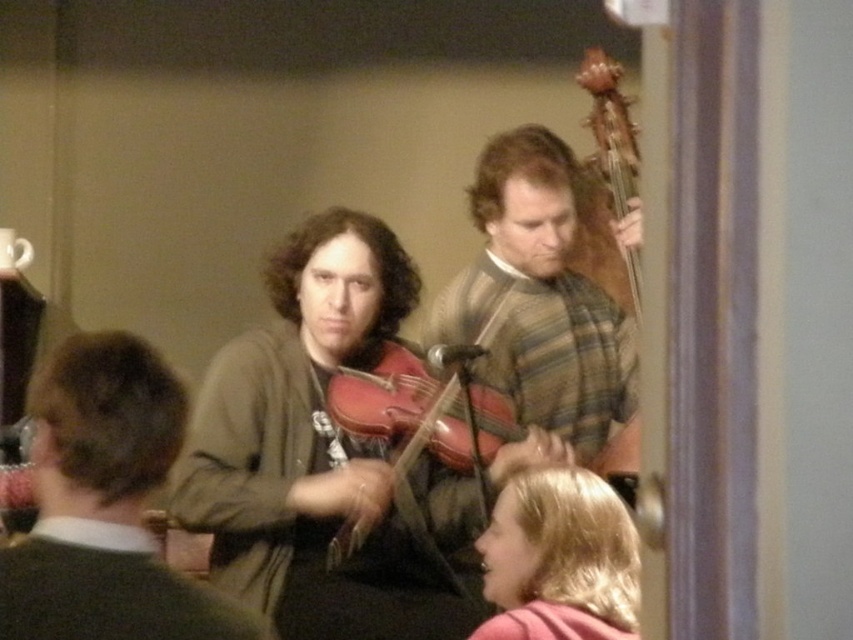
Looking at this image, you are organizing a music event and need to place a microphone stand exactly at the coordinates where the matte brown violin at center is located. What are the coordinates where you should place the microphone stand?

The coordinates for the matte brown violin at center are at point (106,506), so you should place the microphone stand there.

You are a photographer trying to capture the striped wool sweater at center and the matte wood violin at center in the same frame. Which object should you adjust your camera to focus on first if you want to ensure both are in focus, considering their positions?

The striped wool sweater at center is to the right of the matte wood violin at center. To ensure both are in focus, focus on the matte wood violin at center first since it is closer to the left edge, allowing the depth of field to naturally extend to the right towards the sweater.